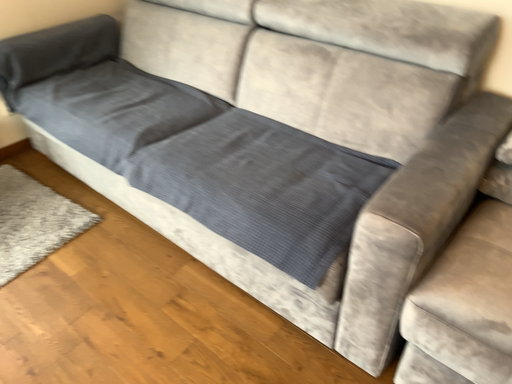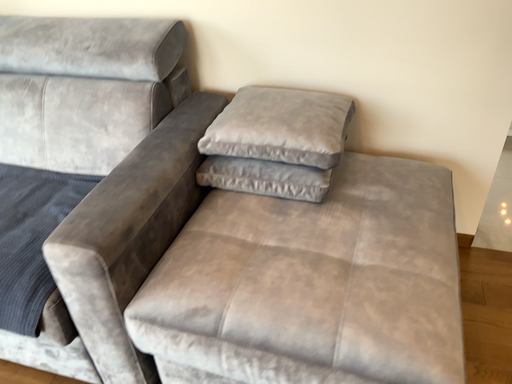
Question: How did the camera likely rotate when shooting the video?

Choices:
 (A) rotated right
 (B) rotated left

Answer: (A)